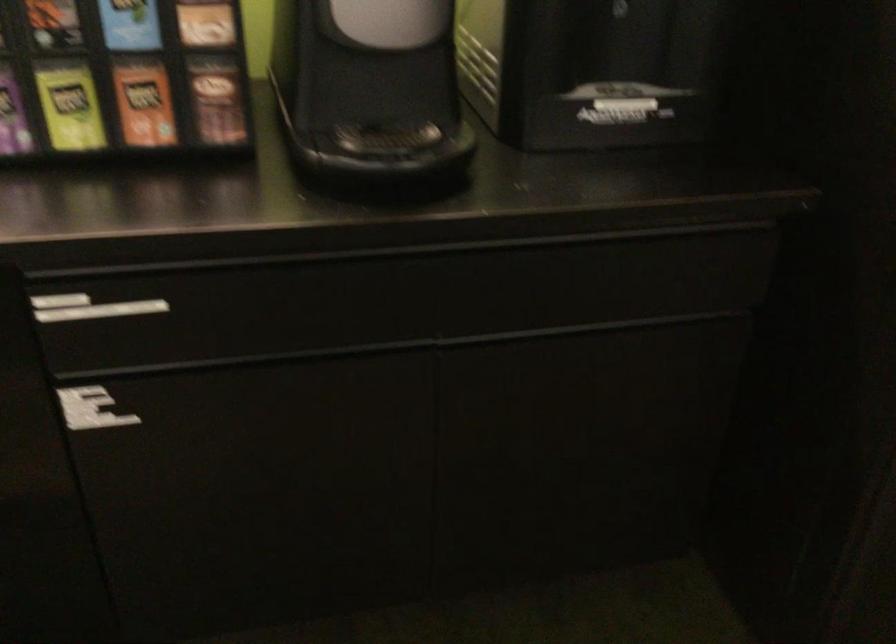
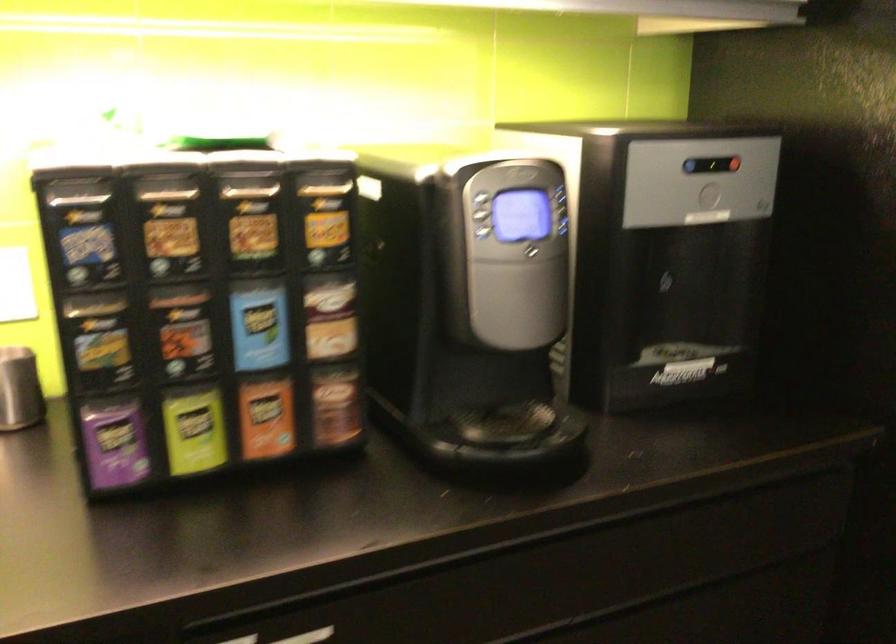
Question: Which direction would the cameraman need to move to produce the second image? Reply with the corresponding letter.

Choices:
 (A) Left
 (B) Right
 (C) Forward
 (D) Backward

Answer: (A)